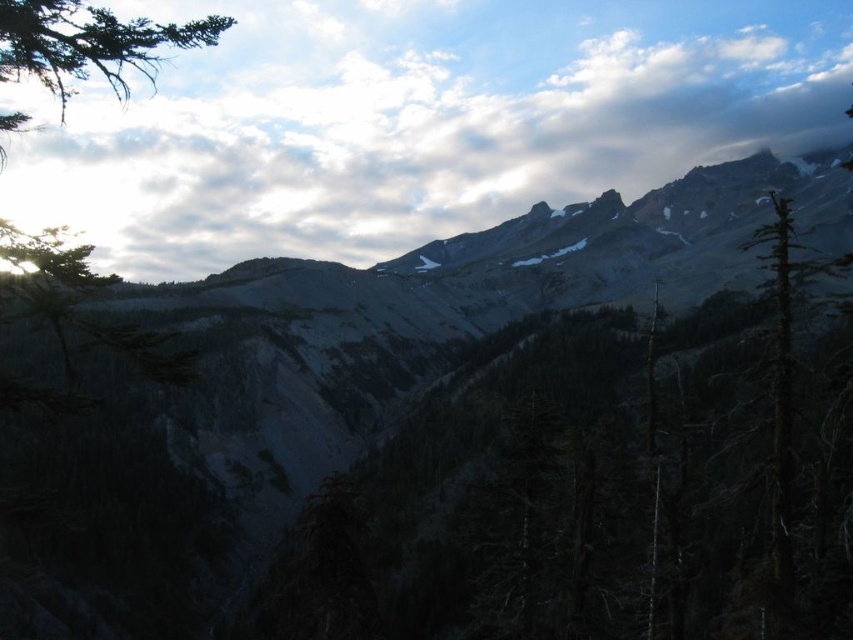
Question: Can you confirm if white fluffy cloud at upper center is positioned above green textured pine branch at upper left?

Choices:
 (A) no
 (B) yes

Answer: (B)

Question: Which of the following is the farthest from the observer?

Choices:
 (A) dark green textured tree at right
 (B) white fluffy cloud at upper center

Answer: (B)

Question: Does green textured pine branch at upper left appear on the right side of dark green textured tree at right?

Choices:
 (A) yes
 (B) no

Answer: (B)

Question: Is green textured pine branch at upper left wider than dark green textured tree at right?

Choices:
 (A) yes
 (B) no

Answer: (A)

Question: Which object appears closest to the camera in this image?

Choices:
 (A) white fluffy cloud at upper center
 (B) green textured pine branch at upper left
 (C) dark green textured tree at right

Answer: (B)

Question: Among these objects, which one is farthest from the camera?

Choices:
 (A) white fluffy cloud at upper center
 (B) green textured pine branch at upper left
 (C) dark green textured tree at right

Answer: (A)